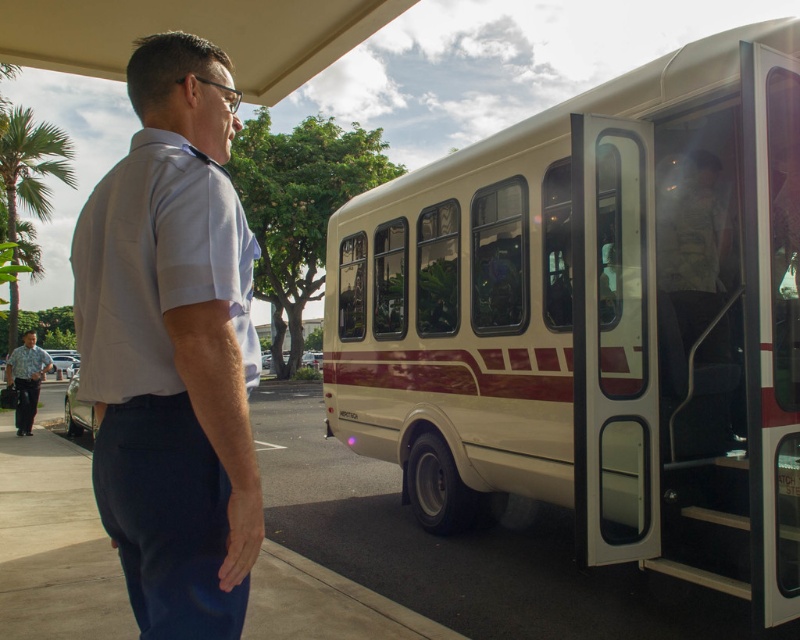
You are standing at the point labeled point (218, 234) and want to walk to the point labeled point (34, 396). Based on the scene description, which direction should you move to get closer to your destination?

Since point (218, 234) is closer to the camera than point (34, 396), you should move forward towards the direction of the bus to reach your destination.